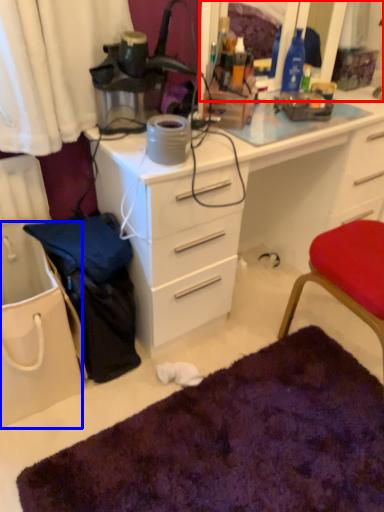
Question: Among these objects, which one is farthest to the camera, mirror (highlighted by a red box) or handbag (highlighted by a blue box)?

Choices:
 (A) mirror
 (B) handbag

Answer: (A)